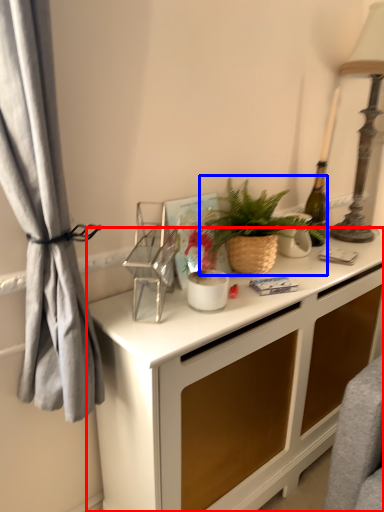
Question: Which object appears farthest to the camera in this image, desk (highlighted by a red box) or houseplant (highlighted by a blue box)?

Choices:
 (A) desk
 (B) houseplant

Answer: (B)